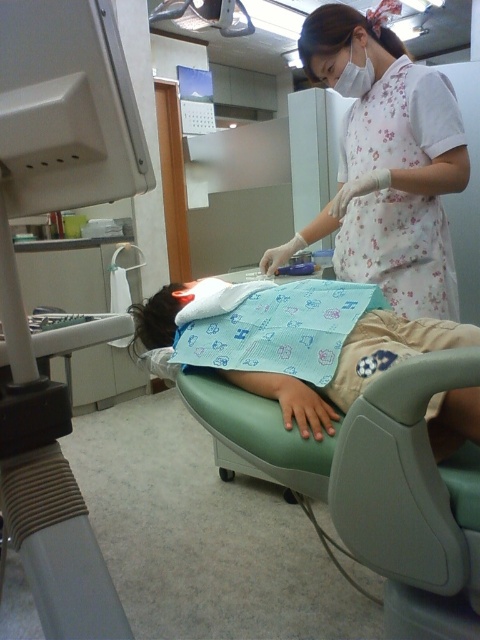
You are a dental assistant standing 1.6 meters tall. You need to hand a tool to the dental professional wearing the white floral uniform at upper right. The tool is on a tray placed on a shelf 1.2 meters above the floor. Can you reach the tool without a stool?

The white floral uniform at upper right is 1.50 meters from the camera. Since you are 1.6 meters tall and the tool is on a shelf 1.2 meters high, you can reach it as your height exceeds the shelf height. However, the distance to the professional may require you to move closer to hand over the tool effectively.

In the scene shown: You are a patient entering the dental clinic and see the beige rubber dental chair at left and the white floral uniform at upper right. Which object is positioned lower in the image?

The beige rubber dental chair at left is located below the white floral uniform at upper right, so it is positioned lower in the image.

You are a patient in the dental clinic and you want to check if the white floral uniform at upper right is covering the blue fabric at center. Can you confirm this?

The white floral uniform at upper right is positioned over blue fabric at center, so yes, the white floral uniform at upper right is covering the blue fabric at center.